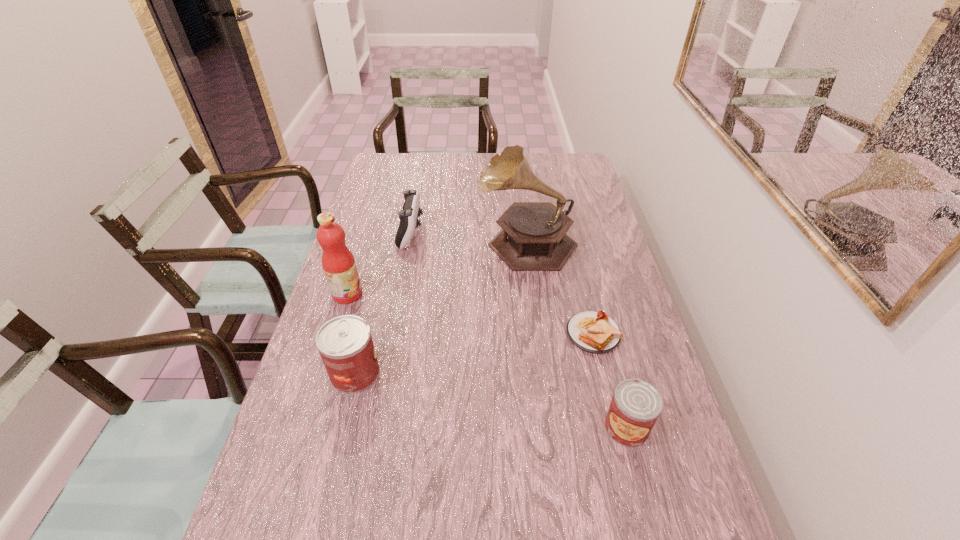
Where is `sandwich that is at the right edge`? sandwich that is at the right edge is located at coordinates (594, 332).

The width and height of the screenshot is (960, 540). Identify the location of vacant space at the far edge of the desktop. [x=461, y=167].

Where is `free point at the near edge`? The width and height of the screenshot is (960, 540). free point at the near edge is located at coordinates (371, 508).

At what (x,y) coordinates should I click in order to perform the action: click on vacant space at the left edge of the desktop. Please return your answer as a coordinate pair (x, y). Looking at the image, I should click on (369, 271).

Where is `vacant space at the right edge of the desktop`? The image size is (960, 540). vacant space at the right edge of the desktop is located at coordinates (617, 265).

Where is `vacant region at the far right corner of the desktop`? The width and height of the screenshot is (960, 540). vacant region at the far right corner of the desktop is located at coordinates (558, 153).

Identify the location of vacant space that is in between the sandwich and the nearer can. (610, 381).

This screenshot has width=960, height=540. I want to click on free space between the taller can and the sandwich, so click(x=474, y=353).

At what (x,y) coordinates should I click in order to perform the action: click on free space between the shortest object and the left can. Please return your answer as a coordinate pair (x, y). The height and width of the screenshot is (540, 960). Looking at the image, I should click on (474, 353).

At what (x,y) coordinates should I click in order to perform the action: click on vacant area that lies between the shorter can and the shortest object. Please return your answer as a coordinate pair (x, y). Image resolution: width=960 pixels, height=540 pixels. Looking at the image, I should click on (610, 381).